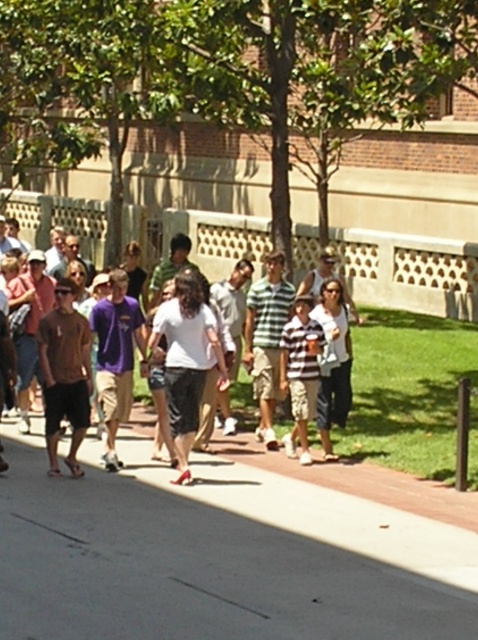
You are standing at the origin point of the coordinate system in the image. You need to walk to the gray concrete sidewalk at center. What direction should you walk in?

The gray concrete sidewalk at center is located at coordinate point 0.873 on the x axis and 0.456 on the y axis. Since you are at the origin point, you should walk in the direction of increasing x and y coordinates to reach it.

You are a photographer trying to capture a group photo of the white cotton shirt at center and the striped fabric shirt at center. Since you want to ensure both subjects are in the frame, which direction should you position the camera relative to the group?

The white cotton shirt at center is positioned on the left side of striped fabric shirt at center, so you should position the camera to the left of the group to include both subjects in the frame.